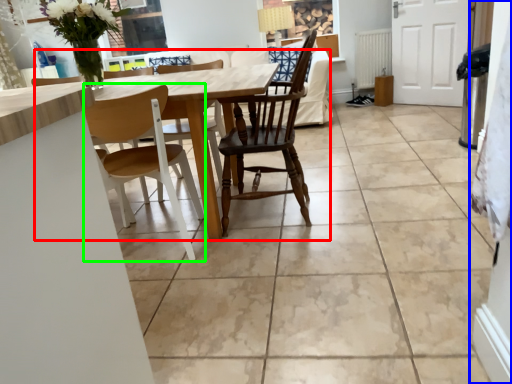
Question: Which is farther away from kitchen & dining room table (highlighted by a red box)? side (highlighted by a blue box) or chair (highlighted by a green box)?

Choices:
 (A) side
 (B) chair

Answer: (A)